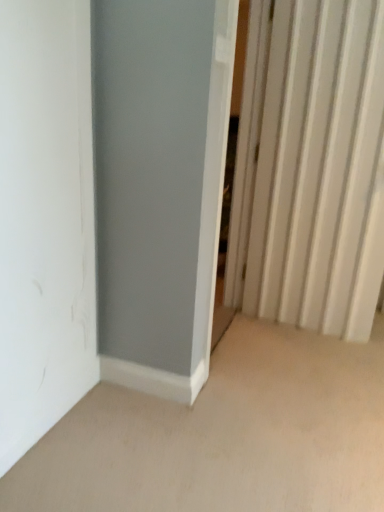
Question: In the image, is white matte door at left positioned in front of or behind white plastic radiator at right?

Choices:
 (A) front
 (B) behind

Answer: (A)

Question: From their relative heights in the image, would you say white matte door at left is taller or shorter than white plastic radiator at right?

Choices:
 (A) tall
 (B) short

Answer: (B)

Question: From a real-world perspective, relative to white plastic radiator at right, is white matte door at left vertically above or below?

Choices:
 (A) above
 (B) below

Answer: (B)

Question: Choose the correct answer: Is white plastic radiator at right inside white matte door at left or outside it?

Choices:
 (A) outside
 (B) inside

Answer: (A)

Question: From a real-world perspective, is white plastic radiator at right above or below white matte door at left?

Choices:
 (A) below
 (B) above

Answer: (B)

Question: Is white plastic radiator at right wider or thinner than white matte door at left?

Choices:
 (A) wide
 (B) thin

Answer: (A)

Question: From the image's perspective, relative to white matte door at left, is white plastic radiator at right above or below?

Choices:
 (A) below
 (B) above

Answer: (B)